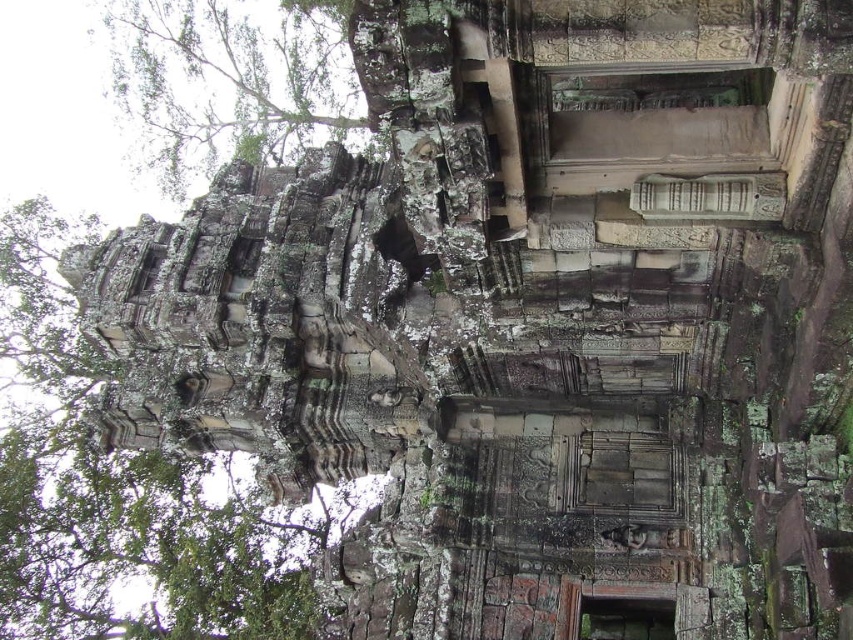
Between green mossy stone tower at left and green leafy tree at upper left, which one has less height?

Standing shorter between the two is green leafy tree at upper left.

In order to click on green mossy stone tower at left in this screenshot , I will do `click(125, 492)`.